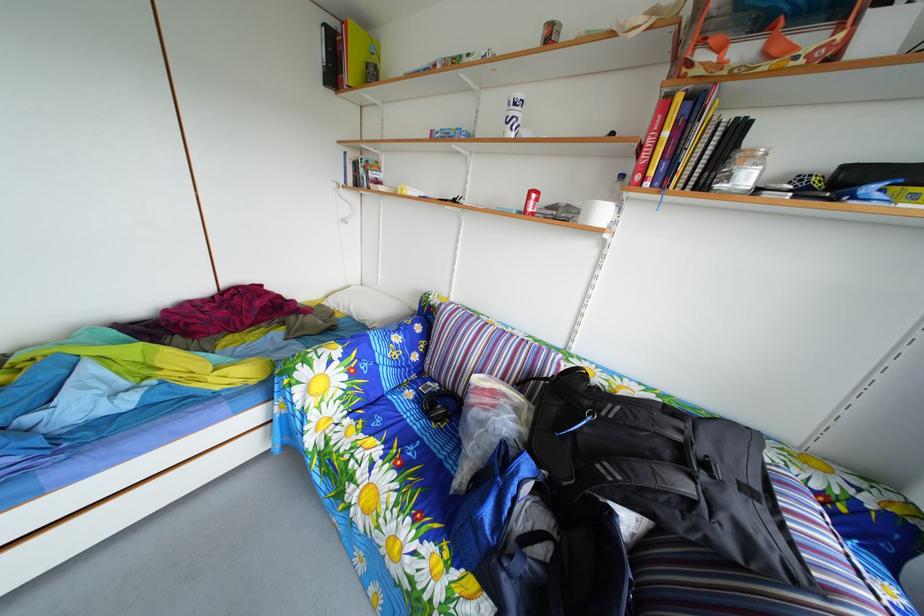
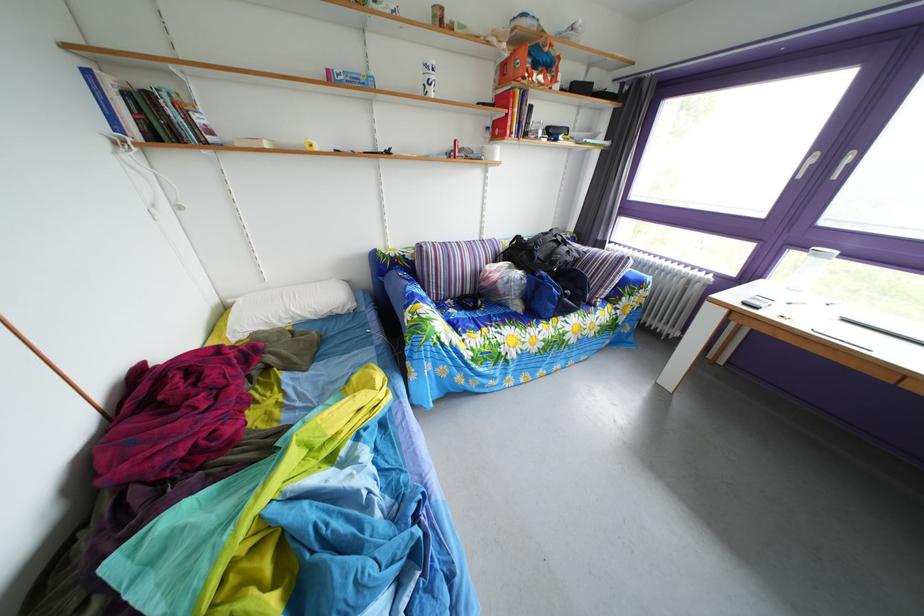
In the second image, find the point that corresponds to pixel 420 402 in the first image.

(463, 320)